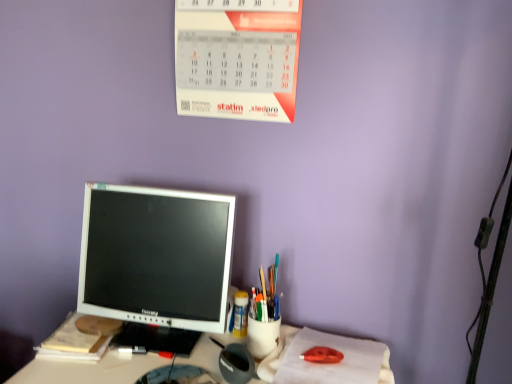
Locate an element on the screen. The width and height of the screenshot is (512, 384). free space above yellow paper notebook at lower left (from a real-world perspective) is located at coordinates click(x=74, y=333).